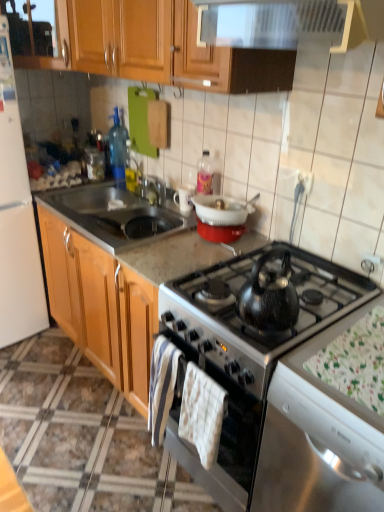
Question: Can you confirm if wooden cabinet at upper left is thinner than white plastic bowl at upper center?

Choices:
 (A) yes
 (B) no

Answer: (B)

Question: Is wooden cabinet at upper left aimed at white plastic bowl at upper center?

Choices:
 (A) no
 (B) yes

Answer: (A)

Question: Is the position of wooden cabinet at upper left less distant than that of white plastic bowl at upper center?

Choices:
 (A) yes
 (B) no

Answer: (B)

Question: Is wooden cabinet at upper left further to the viewer compared to white plastic bowl at upper center?

Choices:
 (A) yes
 (B) no

Answer: (A)

Question: Is wooden cabinet at upper left positioned beyond the bounds of white plastic bowl at upper center?

Choices:
 (A) yes
 (B) no

Answer: (A)

Question: From the image's perspective, is wooden cabinet at upper left on top of white plastic bowl at upper center?

Choices:
 (A) yes
 (B) no

Answer: (A)

Question: Can you confirm if marble gray countertop at center is smaller than white fabric placemat at lower right?

Choices:
 (A) yes
 (B) no

Answer: (B)

Question: Does marble gray countertop at center lie behind white fabric placemat at lower right?

Choices:
 (A) yes
 (B) no

Answer: (A)

Question: Does marble gray countertop at center have a lesser height compared to white fabric placemat at lower right?

Choices:
 (A) yes
 (B) no

Answer: (A)

Question: From a real-world perspective, is marble gray countertop at center on white fabric placemat at lower right?

Choices:
 (A) no
 (B) yes

Answer: (A)

Question: Can you confirm if marble gray countertop at center is taller than white fabric placemat at lower right?

Choices:
 (A) no
 (B) yes

Answer: (A)

Question: Can you confirm if marble gray countertop at center is bigger than white fabric placemat at lower right?

Choices:
 (A) no
 (B) yes

Answer: (B)

Question: Considering the relative sizes of white cotton hand towel at center, positioned as the 1th hand towel in right-to-left order, and white matte refrigerator at left in the image provided, is white cotton hand towel at center, positioned as the 1th hand towel in right-to-left order, bigger than white matte refrigerator at left?

Choices:
 (A) no
 (B) yes

Answer: (A)